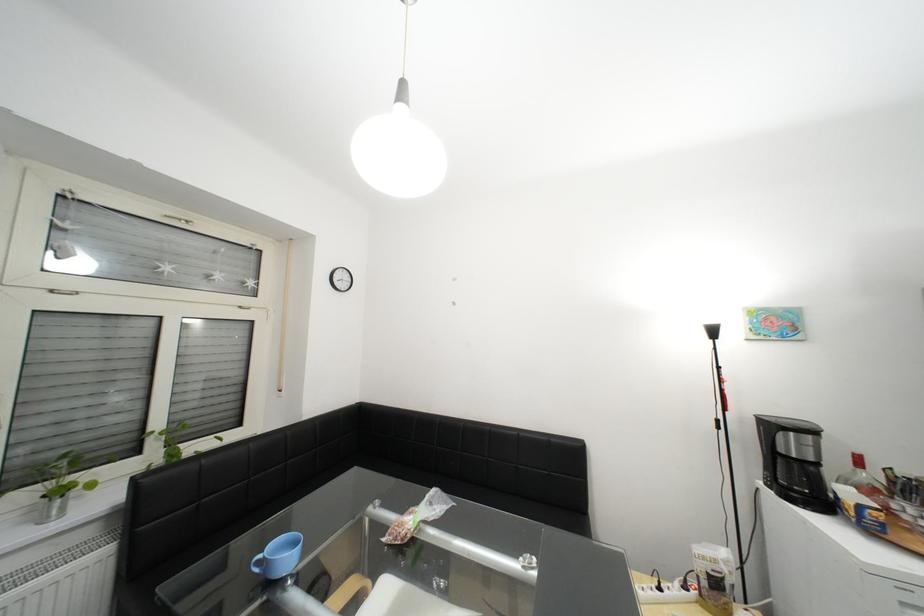
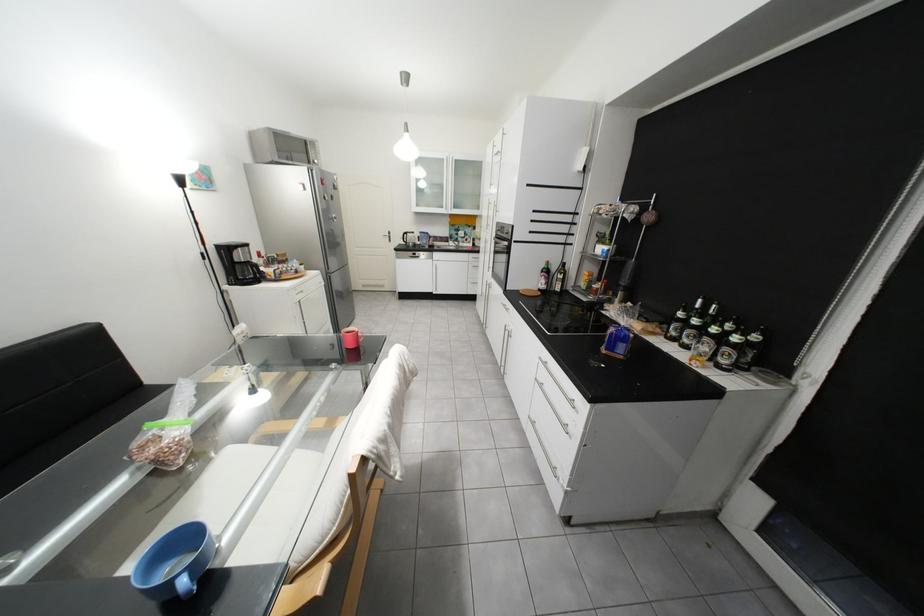
In the second image, find the point that corresponds to point 793,451 in the first image.

(249, 262)